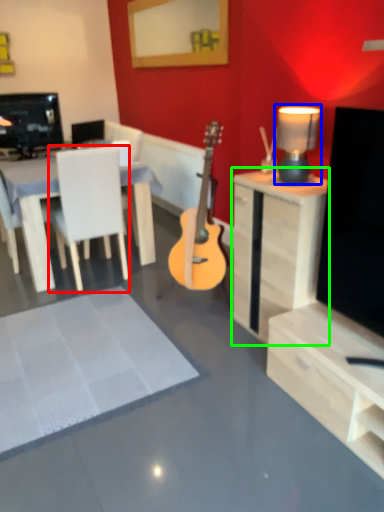
Question: Which object is positioned farthest from chair (highlighted by a red box)? Select from lamp (highlighted by a blue box) and desk (highlighted by a green box).

Choices:
 (A) lamp
 (B) desk

Answer: (A)